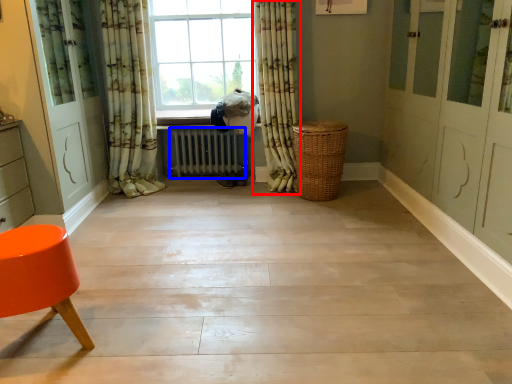
Question: Which point is closer to the camera, curtain (highlighted by a red box) or radiator (highlighted by a blue box)?

Choices:
 (A) curtain
 (B) radiator

Answer: (A)